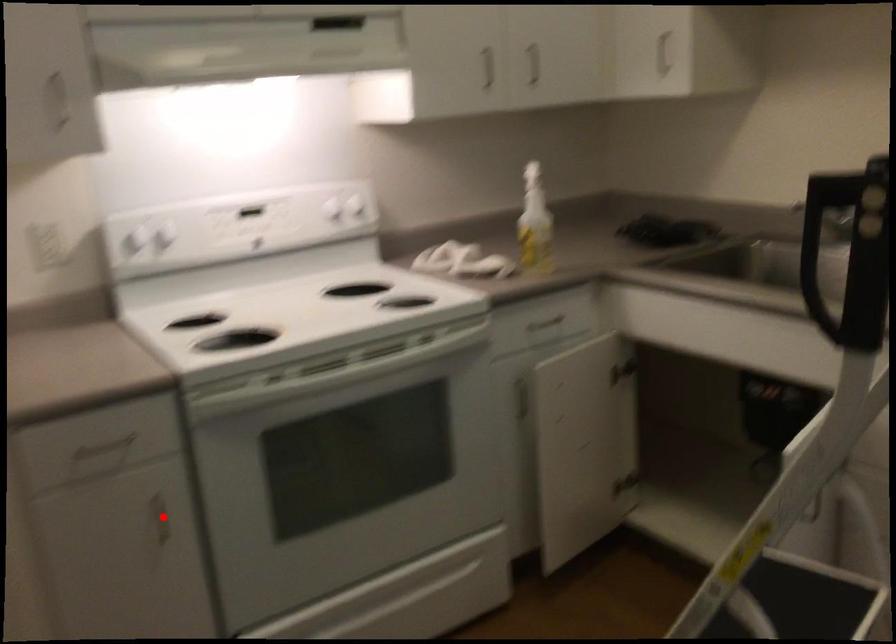
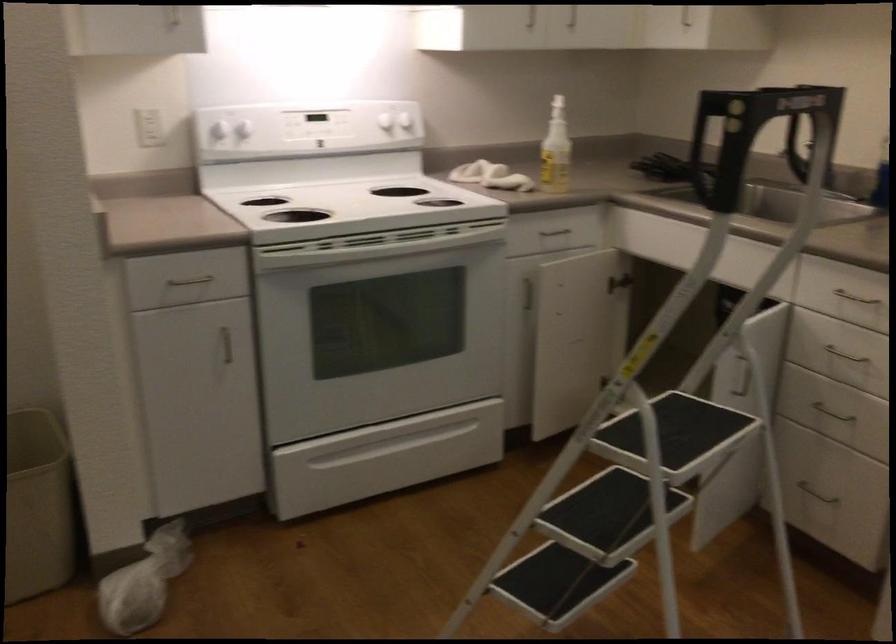
Question: I am providing you with two images of the same scene from different viewpoints. In image1, a red point is highlighted. Considering the same 3D point in image2, which of the following is correct?

Choices:
 (A) It is closer
 (B) It is farther

Answer: (B)